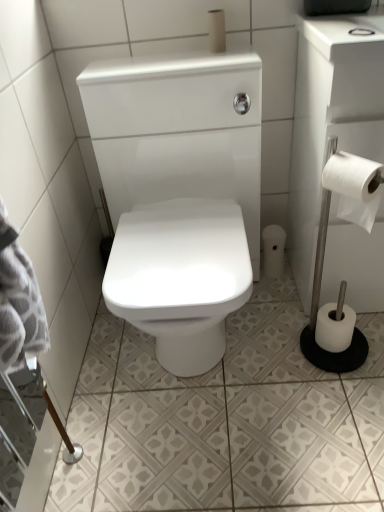
This screenshot has height=512, width=384. I want to click on free location to the right of white matte toilet paper at lower right, the first toilet paper from the right, so click(368, 343).